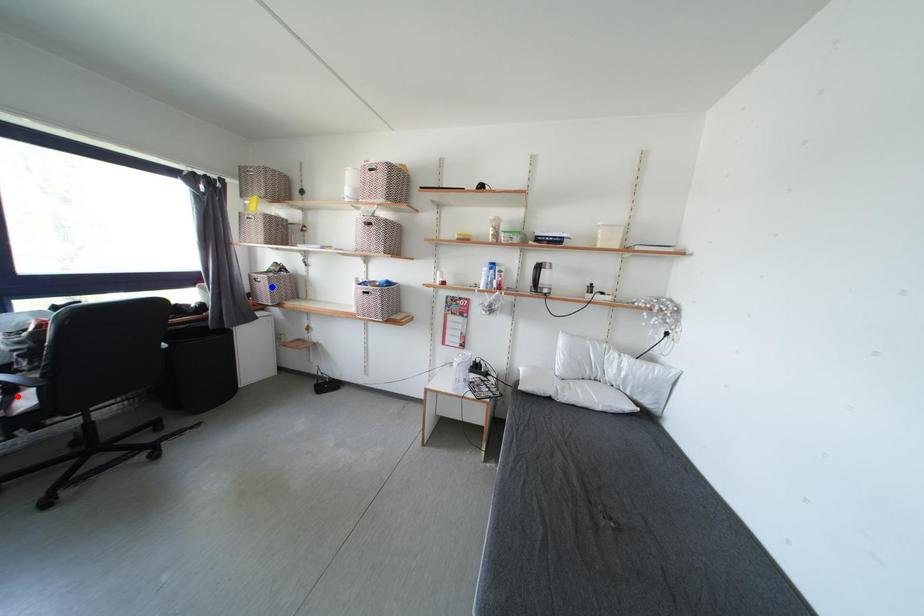
Question: Which of the two points in the image is closer to the camera?

Choices:
 (A) Blue point is closer.
 (B) Red point is closer.

Answer: (B)